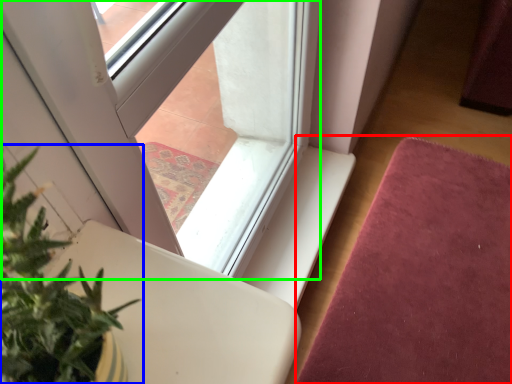
Question: Based on their relative distances, which object is farther from mat (highlighted by a red box)? Choose from houseplant (highlighted by a blue box) and window (highlighted by a green box).

Choices:
 (A) houseplant
 (B) window

Answer: (A)